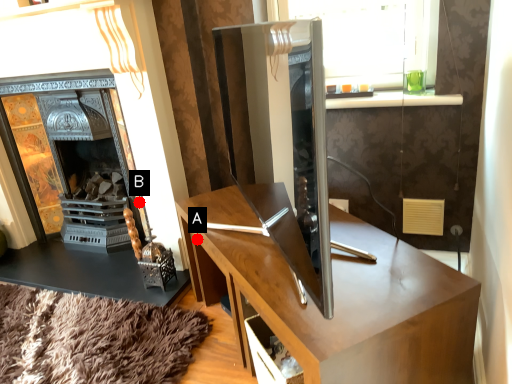
Question: Two points are circled on the image, labeled by A and B beside each circle. Among these points, which one is farthest from the camera?

Choices:
 (A) A is further
 (B) B is further

Answer: (B)